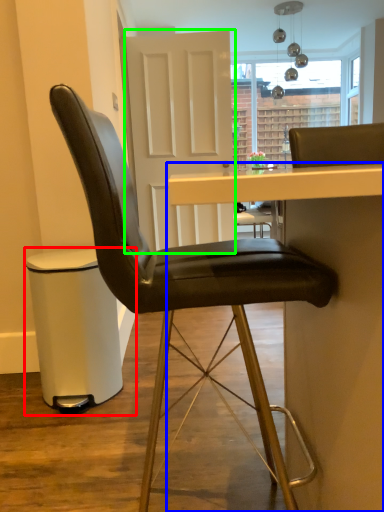
Question: Estimate the real-world distances between objects in this image. Which object is farther from bar stool (highlighted by a red box), table (highlighted by a blue box) or glass door (highlighted by a green box)?

Choices:
 (A) table
 (B) glass door

Answer: (B)